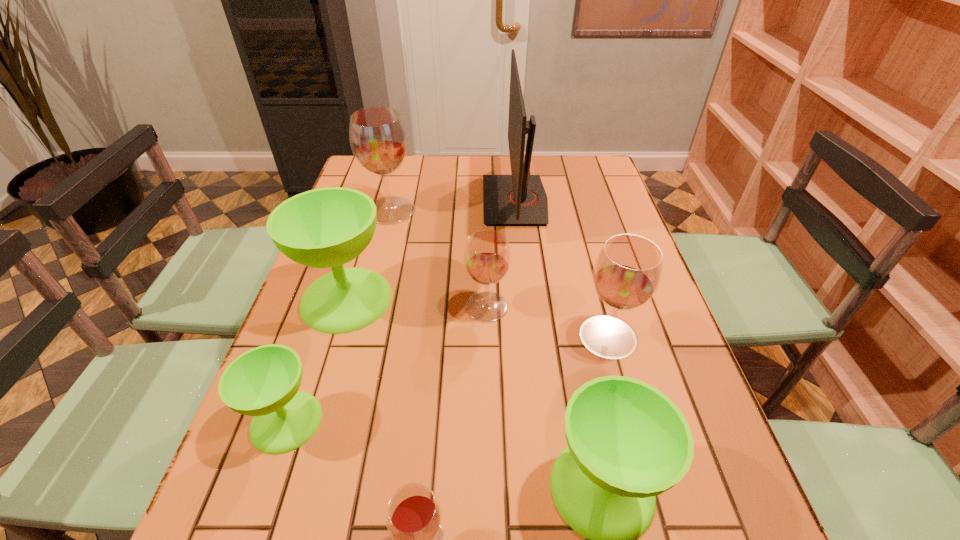
This screenshot has width=960, height=540. Identify the location of free region at the right edge of the desktop. [x=694, y=473].

What are the coordinates of `vacant space at the far right corner of the desktop` in the screenshot? It's located at (584, 173).

This screenshot has width=960, height=540. What are the coordinates of `free area in between the second smallest red wineglass and the smallest green wineglass` in the screenshot? It's located at (387, 364).

Find the location of a particular element. free space between the third biggest red wineglass and the tallest wineglass is located at coordinates (439, 259).

Identify the location of free area in between the monitor and the third smallest red wineglass. (562, 268).

Locate an element on the screen. vacant area that lies between the farthest red wineglass and the biggest green wineglass is located at coordinates (369, 255).

Where is `empty space that is in between the tallest wineglass and the biggest green wineglass`? empty space that is in between the tallest wineglass and the biggest green wineglass is located at coordinates (369, 255).

Image resolution: width=960 pixels, height=540 pixels. In order to click on object identified as the closest to the tallest object in this screenshot , I will do `click(487, 256)`.

Select which object is the second closest to the rightmost red wineglass. Please provide its 2D coordinates. Your answer should be formatted as a tuple, i.e. [(x, y)], where the tuple contains the x and y coordinates of a point satisfying the conditions above.

[(628, 442)]

Select which wineglass appears as the second closest to the smallest green wineglass. Please provide its 2D coordinates. Your answer should be formatted as a tuple, i.e. [(x, y)], where the tuple contains the x and y coordinates of a point satisfying the conditions above.

[(414, 515)]